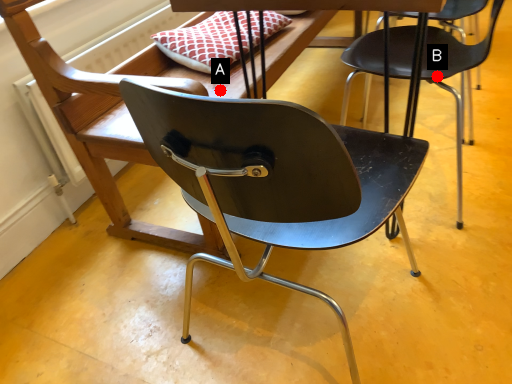
Question: Two points are circled on the image, labeled by A and B beside each circle. Which point appears closest to the camera in this image?

Choices:
 (A) A is closer
 (B) B is closer

Answer: (B)